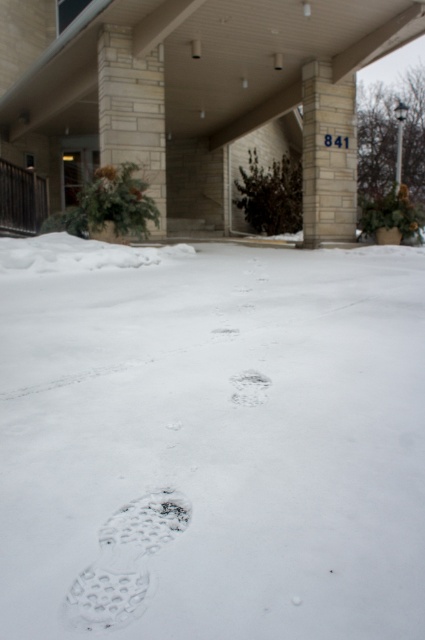
Is point (124, 600) closer to camera compared to point (235, 388)?

Yes, it is.

Is white textured shoe print at lower left further to camera compared to white matte footprint at center?

That is False.

I want to click on white textured shoe print at lower left, so click(124, 561).

How far apart are white fluffy snow at center and white matte footprint at center?

white fluffy snow at center and white matte footprint at center are 4.72 inches apart.

Between point (334, 476) and point (234, 397), which one is positioned in front?

Point (334, 476)

Is point (226, 536) in front of point (252, 380)?

Yes, point (226, 536) is closer to viewer.

Where is `white fluffy snow at center`? white fluffy snow at center is located at coordinates (210, 440).

Does white fluffy snow at center have a lesser width compared to white textured shoe print at lower left?

In fact, white fluffy snow at center might be wider than white textured shoe print at lower left.

Consider the image. Who is positioned more to the right, white fluffy snow at center or white textured shoe print at lower left?

Positioned to the right is white fluffy snow at center.

What are the coordinates of `white fluffy snow at center` in the screenshot? It's located at (210, 440).

You are a GUI agent. You are given a task and a screenshot of the screen. Output one action in this format:
    pyautogui.click(x=<x>, y=<y>)
    Task: Click on the white fluffy snow at center
    The width and height of the screenshot is (425, 640).
    Given the screenshot: What is the action you would take?
    pyautogui.click(x=210, y=440)